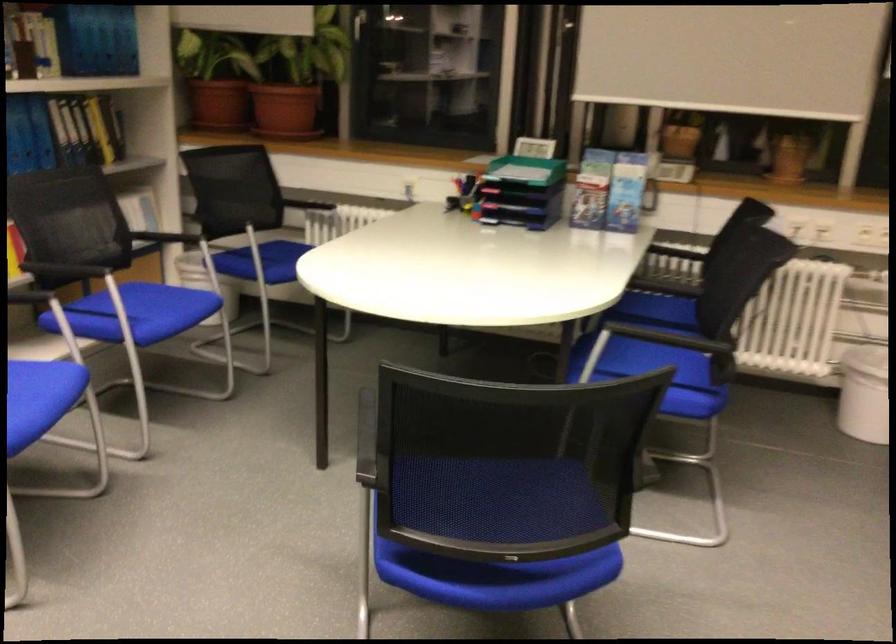
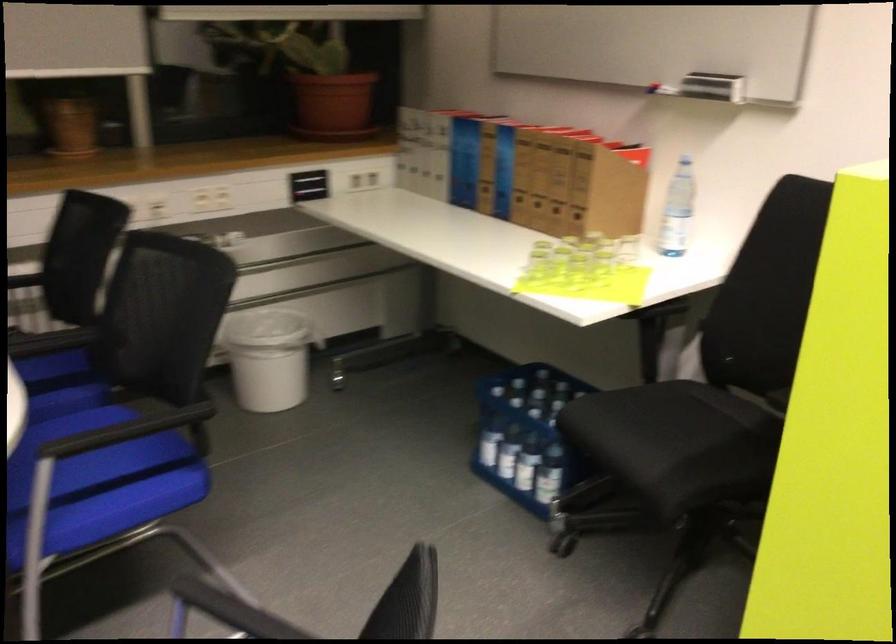
Question: The camera is either moving clockwise (left) or counter-clockwise (right) around the object. The first image is from the beginning of the video and the second image is from the end. Is the camera moving left or right when shooting the video?

Choices:
 (A) Left
 (B) Right

Answer: (A)